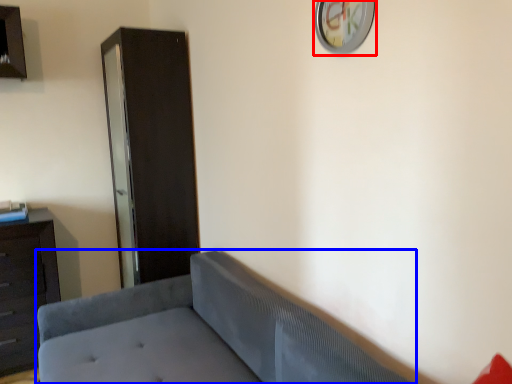
Question: Which point is closer to the camera, clock (highlighted by a red box) or studio couch (highlighted by a blue box)?

Choices:
 (A) clock
 (B) studio couch

Answer: (B)